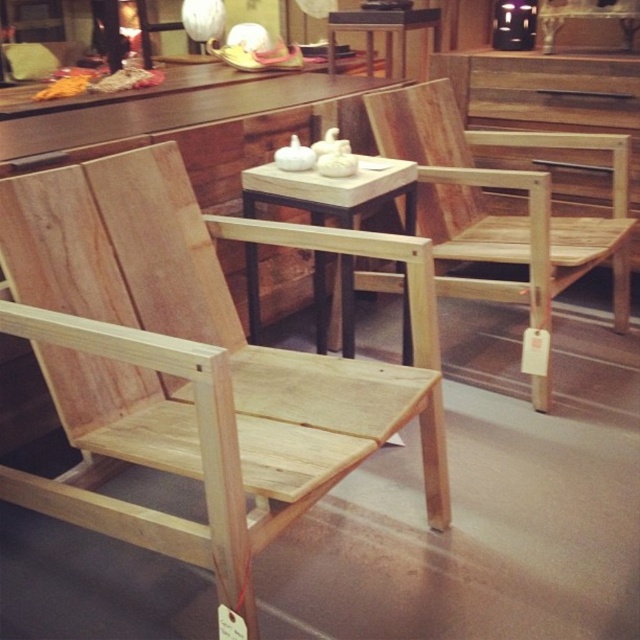
From the picture: You are a customer in a furniture store and see the point marked at coordinates (225, 321). What object is located at that point?

The point at coordinates (225, 321) corresponds to the natural wood chair at left.

You are a customer in a furniture store and see the natural wood chair at left and the matte white lampshade at upper center. Which object is located to the right of the other?

The natural wood chair at left is positioned on the right side of matte white lampshade at upper center, so the natural wood chair at left is to the right of the matte white lampshade at upper center.

You are a customer in the store and want to pick up the matte white lampshade at upper center from the wooden table at center. Can you reach it without moving the table?

The wooden table at center is closer to the viewer than matte white lampshade at upper center, so you can reach the matte white lampshade at upper center by extending your arm over the wooden table at center since it is positioned further away.